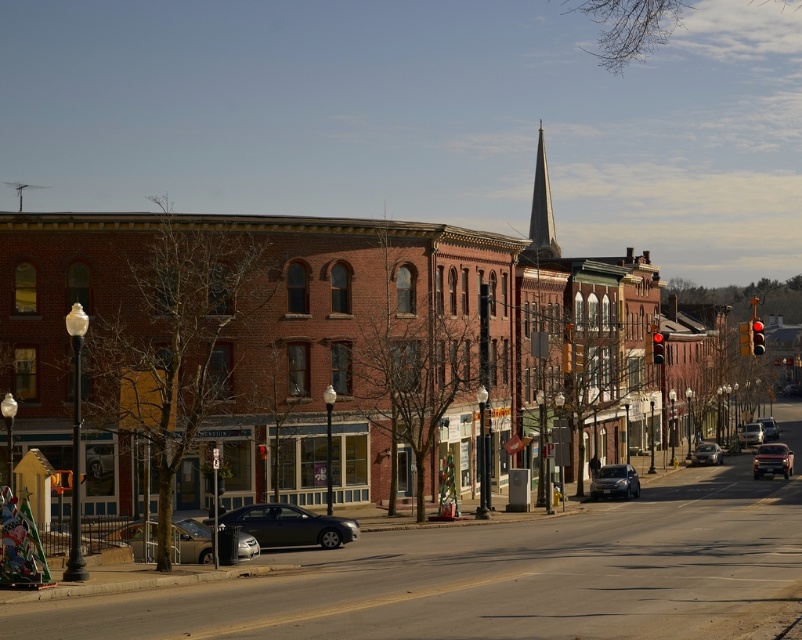
You are a pedestrian standing on the sidewalk and want to cross the street to reach the store across. There are two cars in your view. Which car, the satin black sedan at center or the silver metallic sedan at lower left, is closer to the street edge where you are standing?

The satin black sedan at center is closer to the street edge where you are standing because it is positioned below the silver metallic sedan at lower left.